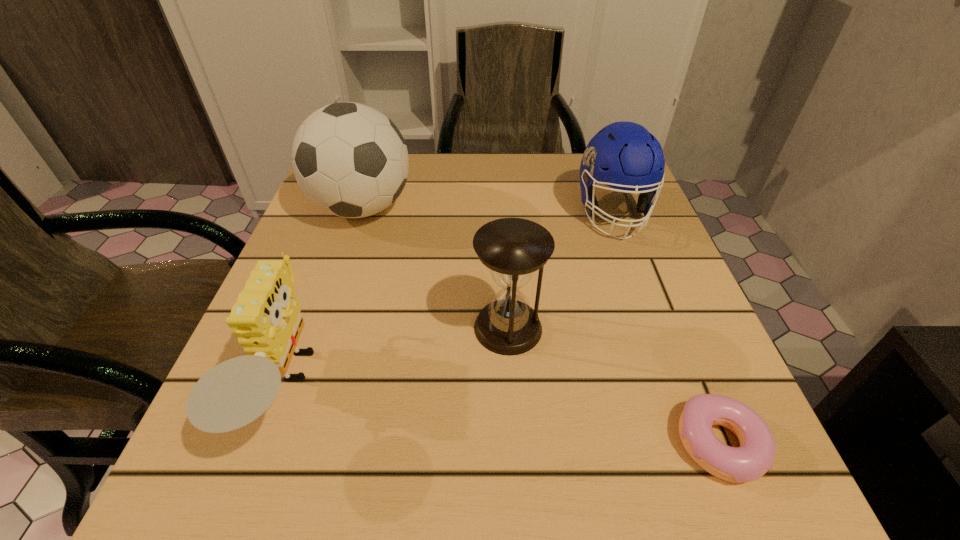
Find the location of a particular element. Image resolution: width=960 pixels, height=540 pixels. soccer ball is located at coordinates (350, 160).

The width and height of the screenshot is (960, 540). Find the location of `football helmet`. football helmet is located at coordinates [623, 155].

Image resolution: width=960 pixels, height=540 pixels. Identify the location of hourglass. (513, 249).

The height and width of the screenshot is (540, 960). What are the coordinates of `sponge` in the screenshot? It's located at (266, 318).

Find the location of `doughnut`. doughnut is located at coordinates (755, 456).

Where is `blank area located on the front of the soccer ball`? The height and width of the screenshot is (540, 960). blank area located on the front of the soccer ball is located at coordinates (303, 388).

Locate an element on the screen. vacant area situated on the front-facing side of the football helmet is located at coordinates (676, 385).

Where is `free space located on the left of the hourglass`? The height and width of the screenshot is (540, 960). free space located on the left of the hourglass is located at coordinates (286, 328).

Find the location of a particular element. The image size is (960, 540). free space located 0.290m on the front-facing side of the sponge is located at coordinates (518, 387).

Locate an element on the screen. Image resolution: width=960 pixels, height=540 pixels. vacant space located on the left of the doughnut is located at coordinates (420, 444).